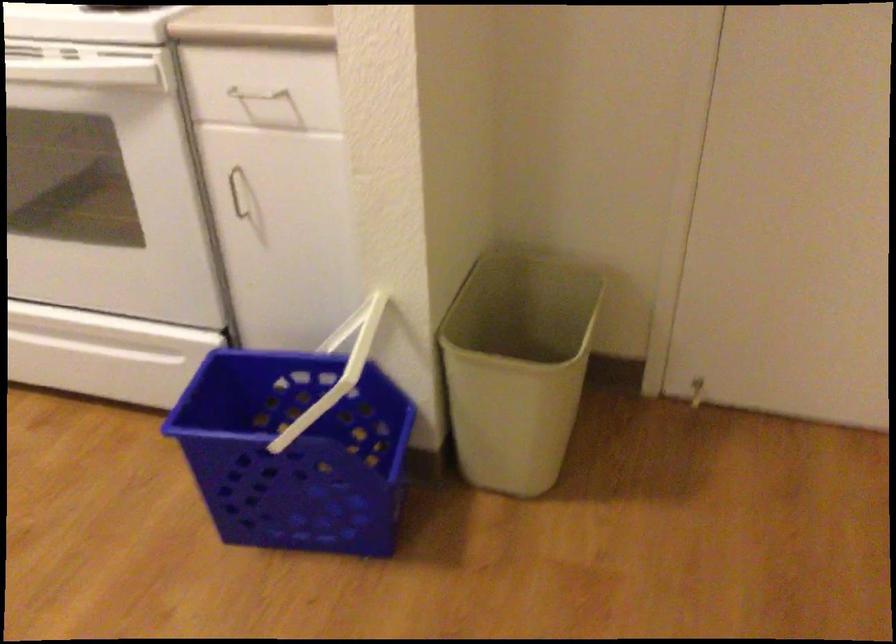
This screenshot has width=896, height=644. In order to click on oven door handle in this screenshot , I will do `click(104, 185)`.